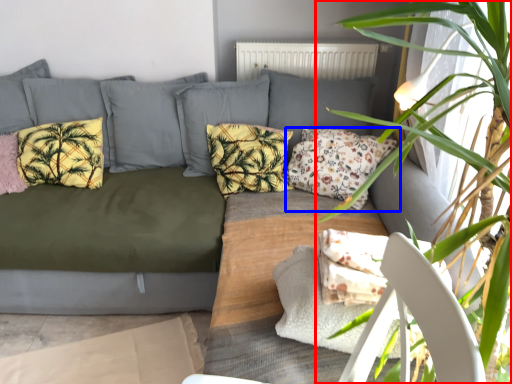
Question: Which object appears farthest to the camera in this image, houseplant (highlighted by a red box) or pillow (highlighted by a blue box)?

Choices:
 (A) houseplant
 (B) pillow

Answer: (B)